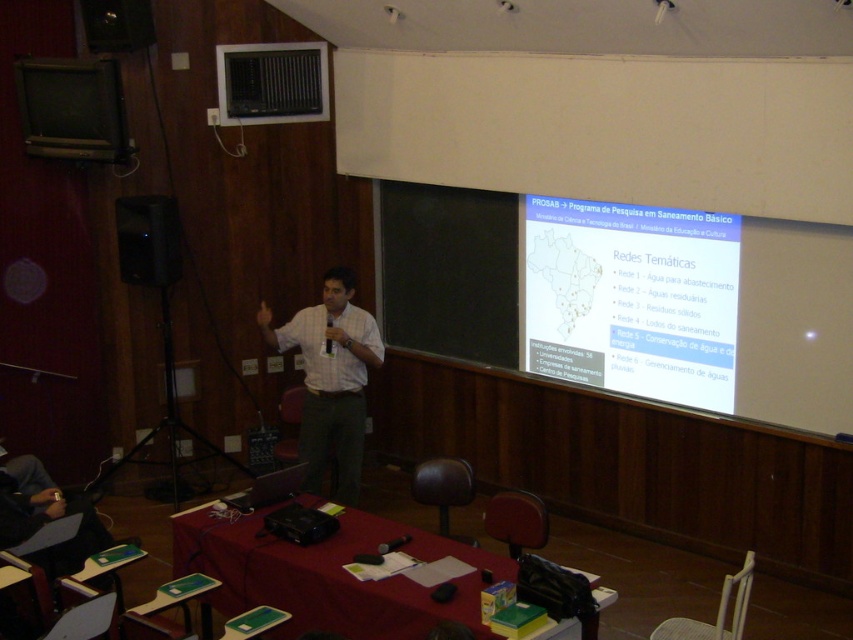
Question: Among these points, which one is nearest to the camera?

Choices:
 (A) (329, 321)
 (B) (142, 260)

Answer: (A)

Question: Is red fabric table at lower center to the left of black matte speaker at left from the viewer's perspective?

Choices:
 (A) yes
 (B) no

Answer: (B)

Question: Among these objects, which one is nearest to the camera?

Choices:
 (A) matte black speaker at upper left
 (B) black plastic microphone at center
 (C) red fabric table at lower center
 (D) white matte projection screen at upper right

Answer: (C)

Question: Can you confirm if white matte projection screen at upper right is wider than black plastic microphone at center?

Choices:
 (A) no
 (B) yes

Answer: (B)

Question: Which of the following is the closest to the observer?

Choices:
 (A) red fabric table at lower center
 (B) black plastic microphone at center

Answer: (A)

Question: Can you confirm if white matte projection screen at upper right is positioned to the right of matte black speaker at upper left?

Choices:
 (A) yes
 (B) no

Answer: (A)